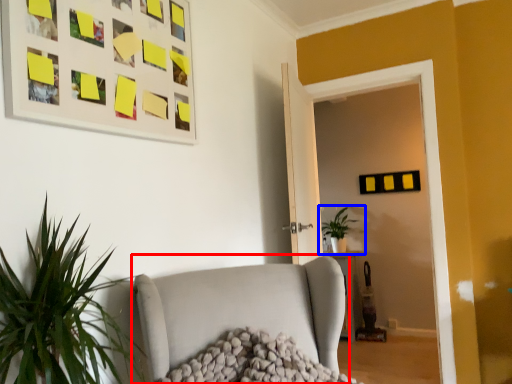
Question: Which object is closer to the camera taking this photo, studio couch (highlighted by a red box) or houseplant (highlighted by a blue box)?

Choices:
 (A) studio couch
 (B) houseplant

Answer: (A)